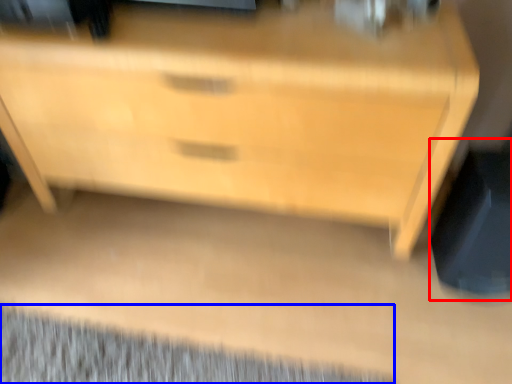
Question: Which of the following is the farthest to the observer, swivel chair (highlighted by a red box) or mat (highlighted by a blue box)?

Choices:
 (A) swivel chair
 (B) mat

Answer: (B)